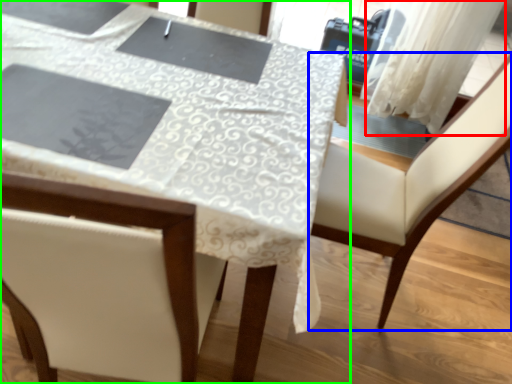
Question: Based on their relative distances, which object is nearer to curtain (highlighted by a red box)? Choose from chair (highlighted by a blue box) and table (highlighted by a green box).

Choices:
 (A) chair
 (B) table

Answer: (A)